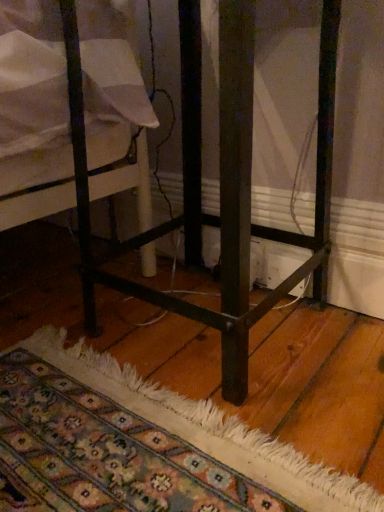
This screenshot has width=384, height=512. In order to click on vacant space underneath metallic black bed frame at center (from a real-world perspective) in this screenshot , I will do `click(205, 331)`.